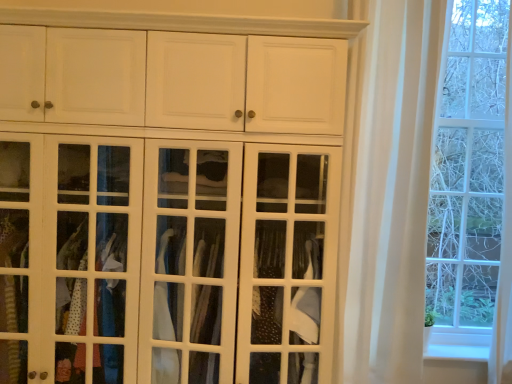
Question: Is white sheer curtain at right further to the viewer compared to white glass cabinet at center?

Choices:
 (A) no
 (B) yes

Answer: (B)

Question: From a real-world perspective, is white sheer curtain at right positioned under white glass cabinet at center based on gravity?

Choices:
 (A) no
 (B) yes

Answer: (A)

Question: Are white sheer curtain at right and white glass cabinet at center located far from each other?

Choices:
 (A) no
 (B) yes

Answer: (A)

Question: From the image's perspective, does white sheer curtain at right appear lower than white glass cabinet at center?

Choices:
 (A) no
 (B) yes

Answer: (A)

Question: Can white glass cabinet at center be found inside white sheer curtain at right?

Choices:
 (A) yes
 (B) no

Answer: (B)

Question: From a real-world perspective, is white sheer curtain at right positioned over white glass cabinet at center based on gravity?

Choices:
 (A) no
 (B) yes

Answer: (B)

Question: Does white glass cabinet at center have a smaller size compared to white sheer curtain at right?

Choices:
 (A) no
 (B) yes

Answer: (A)

Question: From a real-world perspective, does white glass cabinet at center stand above white sheer curtain at right?

Choices:
 (A) no
 (B) yes

Answer: (A)

Question: From the image's perspective, does white glass cabinet at center appear lower than white sheer curtain at right?

Choices:
 (A) no
 (B) yes

Answer: (B)

Question: Would you say white sheer curtain at right is part of white glass cabinet at center's contents?

Choices:
 (A) yes
 (B) no

Answer: (B)

Question: Is white glass cabinet at center looking in the opposite direction of white sheer curtain at right?

Choices:
 (A) no
 (B) yes

Answer: (A)

Question: Does white glass cabinet at center appear on the left side of white sheer curtain at right?

Choices:
 (A) yes
 (B) no

Answer: (A)

Question: In terms of size, does white sheer curtain at right appear bigger or smaller than white glass cabinet at center?

Choices:
 (A) big
 (B) small

Answer: (B)